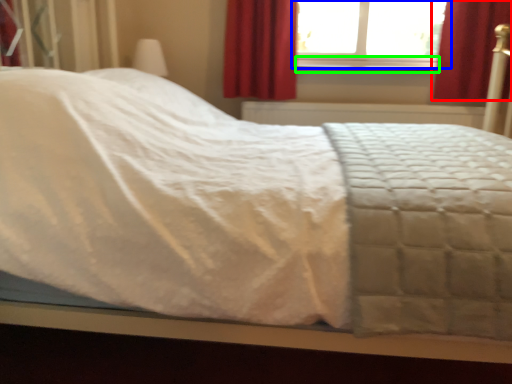
Question: Which is nearer to the curtain (highlighted by a red box)? window (highlighted by a blue box) or window sill (highlighted by a green box).

Choices:
 (A) window
 (B) window sill

Answer: (B)